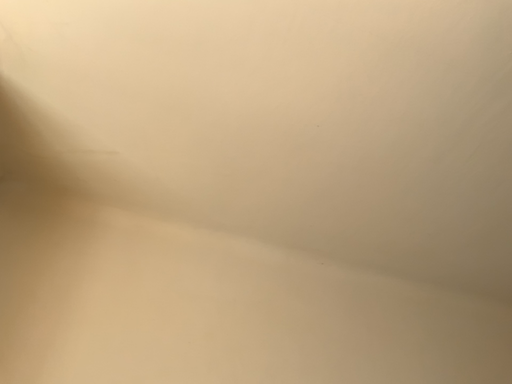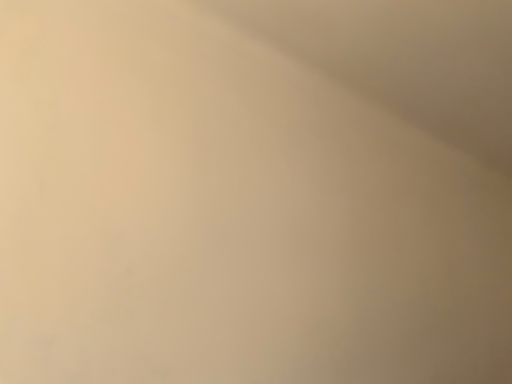
Question: Which way did the camera rotate in the video?

Choices:
 (A) rotated right
 (B) rotated left

Answer: (A)